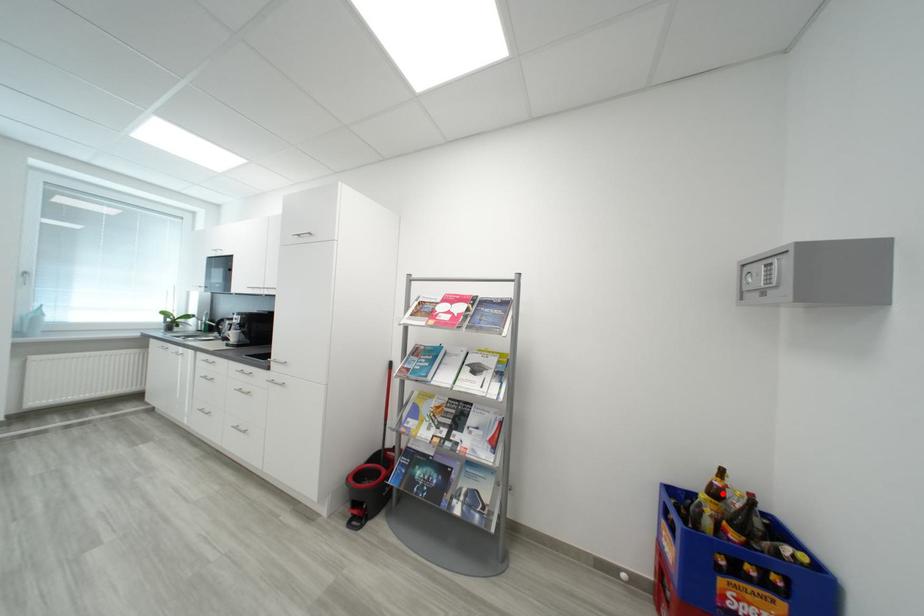
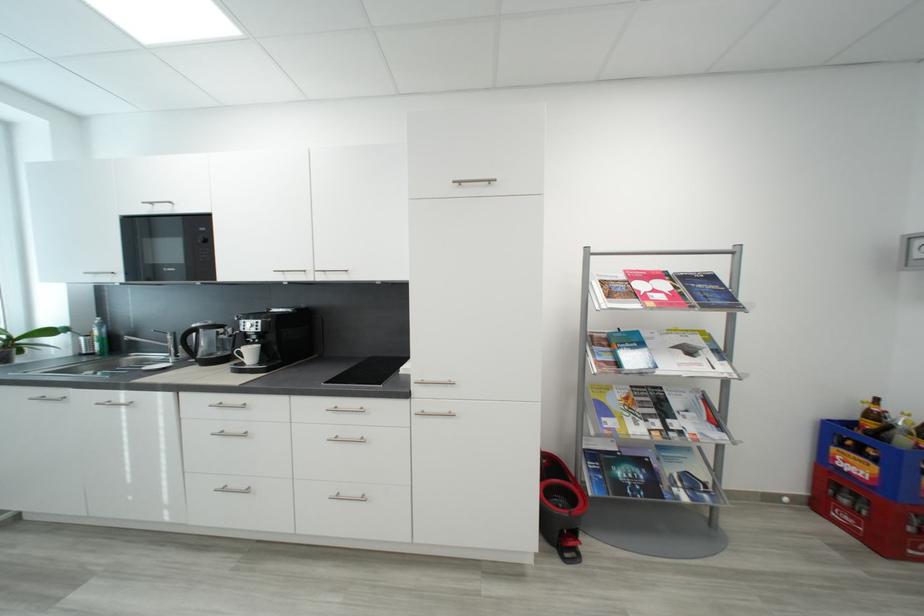
In the second image, find the point that corresponds to the highlighted location in the first image.

(881, 418)